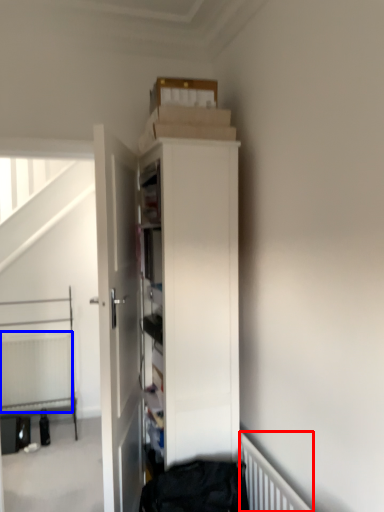
Question: Among these objects, which one is farthest to the camera, radiator (highlighted by a red box) or radiator (highlighted by a blue box)?

Choices:
 (A) radiator
 (B) radiator

Answer: (B)